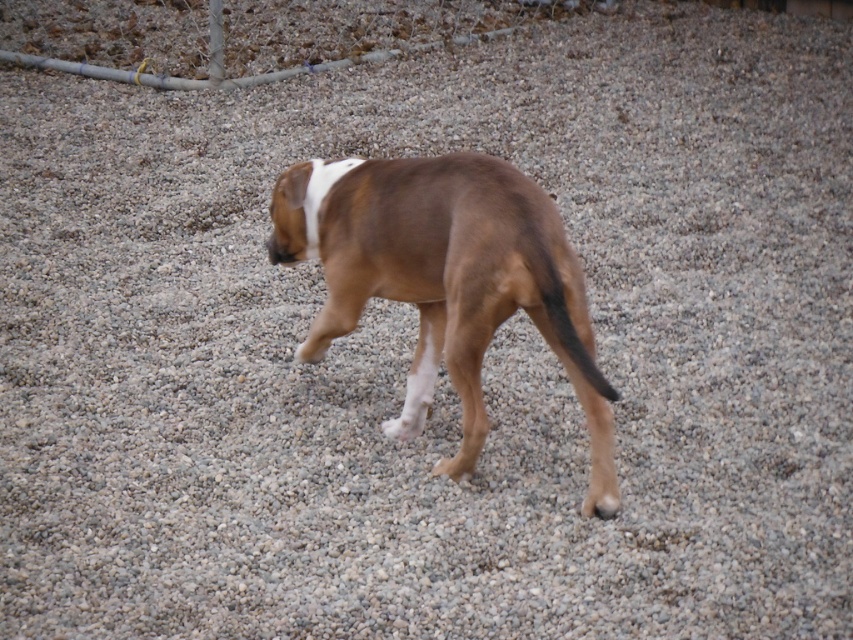
Identify the location of brown matte dog at center. The width and height of the screenshot is (853, 640). (445, 280).

Does brown matte dog at center have a larger size compared to brown matte tail at center?

Correct, brown matte dog at center is larger in size than brown matte tail at center.

Between point (364, 180) and point (556, 330), which one is positioned behind?

Point (364, 180)

At what (x,y) coordinates should I click in order to perform the action: click on brown matte dog at center. Please return your answer as a coordinate pair (x, y). The width and height of the screenshot is (853, 640). Looking at the image, I should click on (445, 280).